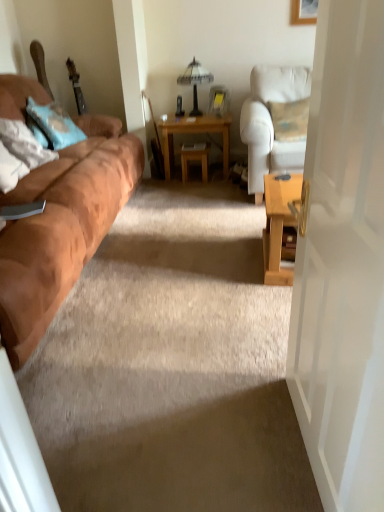
Question: Can you confirm if wooden picture frame at upper right is bigger than wooden stool at center?

Choices:
 (A) yes
 (B) no

Answer: (B)

Question: Does wooden picture frame at upper right have a smaller size compared to wooden stool at center?

Choices:
 (A) yes
 (B) no

Answer: (A)

Question: From a real-world perspective, does wooden picture frame at upper right sit lower than wooden stool at center?

Choices:
 (A) no
 (B) yes

Answer: (A)

Question: Is wooden picture frame at upper right directly adjacent to wooden stool at center?

Choices:
 (A) yes
 (B) no

Answer: (B)

Question: Is wooden picture frame at upper right oriented away from wooden stool at center?

Choices:
 (A) no
 (B) yes

Answer: (A)

Question: Is wooden picture frame at upper right taller than wooden stool at center?

Choices:
 (A) no
 (B) yes

Answer: (A)

Question: From the image's perspective, is light brown wooden table at center beneath soft white pillow at left, which is the 2th pillow from back to front?

Choices:
 (A) no
 (B) yes

Answer: (A)

Question: Can soft white pillow at left, which ranks as the 1th pillow in front-to-back order, be found inside light brown wooden table at center?

Choices:
 (A) no
 (B) yes

Answer: (A)

Question: Can you confirm if light brown wooden table at center is bigger than soft white pillow at left, which ranks as the 1th pillow in front-to-back order?

Choices:
 (A) yes
 (B) no

Answer: (A)

Question: Is light brown wooden table at center in front of soft white pillow at left, which ranks as the 1th pillow in front-to-back order?

Choices:
 (A) no
 (B) yes

Answer: (A)

Question: From a real-world perspective, is light brown wooden table at center under soft white pillow at left, which ranks as the 1th pillow in front-to-back order?

Choices:
 (A) no
 (B) yes

Answer: (B)

Question: Is light brown wooden table at center to the right of soft white pillow at left, which ranks as the 1th pillow in front-to-back order, from the viewer's perspective?

Choices:
 (A) no
 (B) yes

Answer: (B)

Question: Is suede brown couch at left located outside light brown wooden table at center?

Choices:
 (A) yes
 (B) no

Answer: (A)